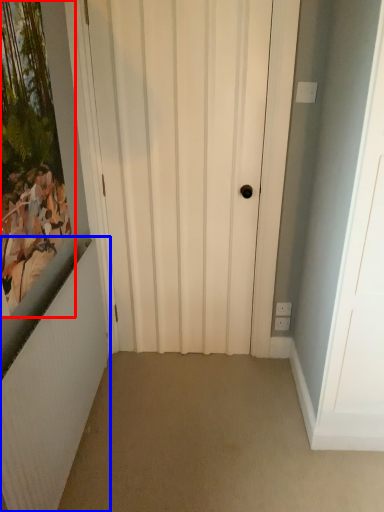
Question: Which point is further to the camera, picture frame (highlighted by a red box) or radiator (highlighted by a blue box)?

Choices:
 (A) picture frame
 (B) radiator

Answer: (B)